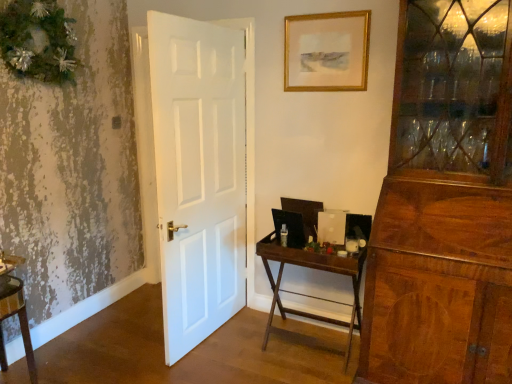
Locate an element on the screen. This screenshot has height=384, width=512. free point to the left of wooden folding table at center is located at coordinates coord(233,348).